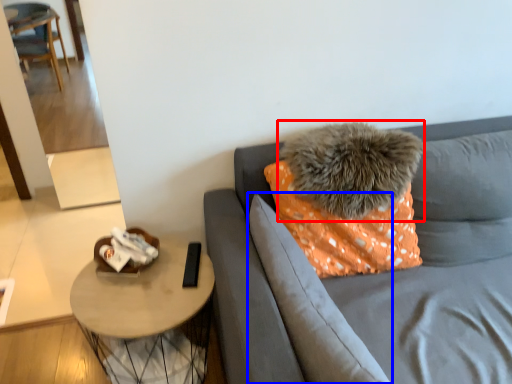
Question: Which object appears farthest to the camera in this image, pillow (highlighted by a red box) or pillow (highlighted by a blue box)?

Choices:
 (A) pillow
 (B) pillow

Answer: (A)